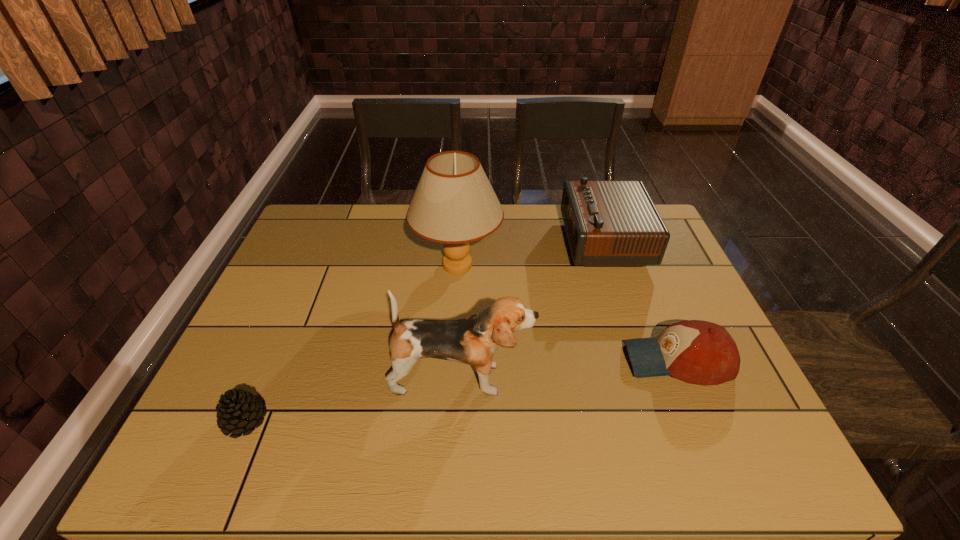
At what (x,y) coordinates should I click in order to perform the action: click on vacant space that is in between the tallest object and the nearest object. Please return your answer as a coordinate pair (x, y). This screenshot has height=540, width=960. Looking at the image, I should click on (351, 343).

Locate an element on the screen. The height and width of the screenshot is (540, 960). free space that is in between the pinecone and the baseball cap is located at coordinates (461, 390).

Identify the location of free area in between the baseball cap and the third shortest object. The image size is (960, 540). [x=640, y=301].

At what (x,y) coordinates should I click in order to perform the action: click on object that ranks as the third closest to the radio receiver. Please return your answer as a coordinate pair (x, y). The image size is (960, 540). Looking at the image, I should click on (473, 340).

At what (x,y) coordinates should I click in order to perform the action: click on object that is the third closest to the tallest object. Please return your answer as a coordinate pair (x, y). Looking at the image, I should click on (698, 352).

Find the location of a particular element. This screenshot has height=540, width=960. free space that satisfies the following two spatial constraints: 1. at the face of the puppy; 2. at the narrow end of the leftmost object is located at coordinates (459, 421).

Image resolution: width=960 pixels, height=540 pixels. I want to click on free location that satisfies the following two spatial constraints: 1. on the front-facing side of the baseball cap; 2. at the narrow end of the leftmost object, so click(x=702, y=421).

Where is `vacant space that satisfies the following two spatial constraints: 1. at the face of the fourth shortest object; 2. at the narrow end of the leftmost object`? The image size is (960, 540). vacant space that satisfies the following two spatial constraints: 1. at the face of the fourth shortest object; 2. at the narrow end of the leftmost object is located at coordinates (459, 421).

Identify the location of free space that satisfies the following two spatial constraints: 1. at the face of the puppy; 2. at the narrow end of the nearest object. (459, 421).

Locate an element on the screen. This screenshot has width=960, height=540. free space that satisfies the following two spatial constraints: 1. at the face of the puppy; 2. at the narrow end of the pinecone is located at coordinates (459, 421).